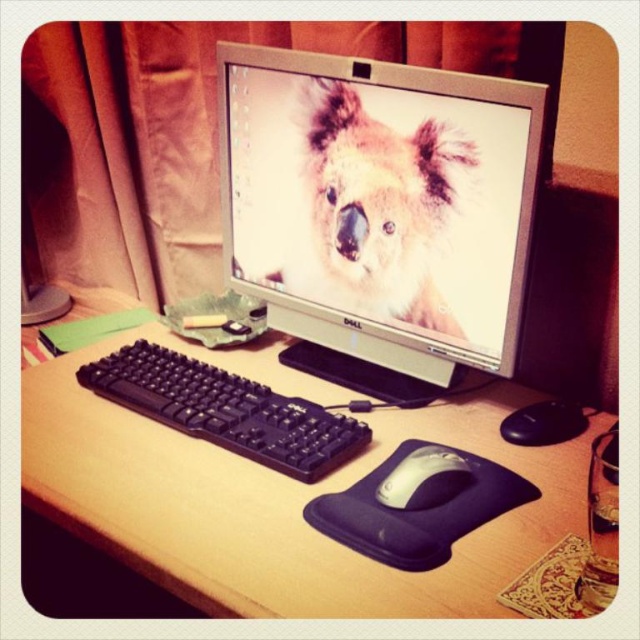
Question: Estimate the real-world distances between objects in this image. Which object is farther from the brown wood computer desk at center?

Choices:
 (A) white matte mouse at center
 (B) fluffy fur koala at center
 (C) satin silver monitor at center

Answer: (B)

Question: Observing the image, what is the correct spatial positioning of brown wood computer desk at center in reference to black plastic keyboard at center?

Choices:
 (A) right
 (B) left

Answer: (A)

Question: Does brown wood computer desk at center have a smaller size compared to white matte mouse at center?

Choices:
 (A) no
 (B) yes

Answer: (A)

Question: Which point is farther to the camera?

Choices:
 (A) (349, 220)
 (B) (435, 300)
 (C) (460, 595)

Answer: (A)

Question: Does satin silver monitor at center have a smaller size compared to brown wood computer desk at center?

Choices:
 (A) no
 (B) yes

Answer: (B)

Question: Which is farther from the white matte mouse at center?

Choices:
 (A) brown wood computer desk at center
 (B) satin silver monitor at center
 (C) black plastic keyboard at center
 (D) fluffy fur koala at center

Answer: (B)